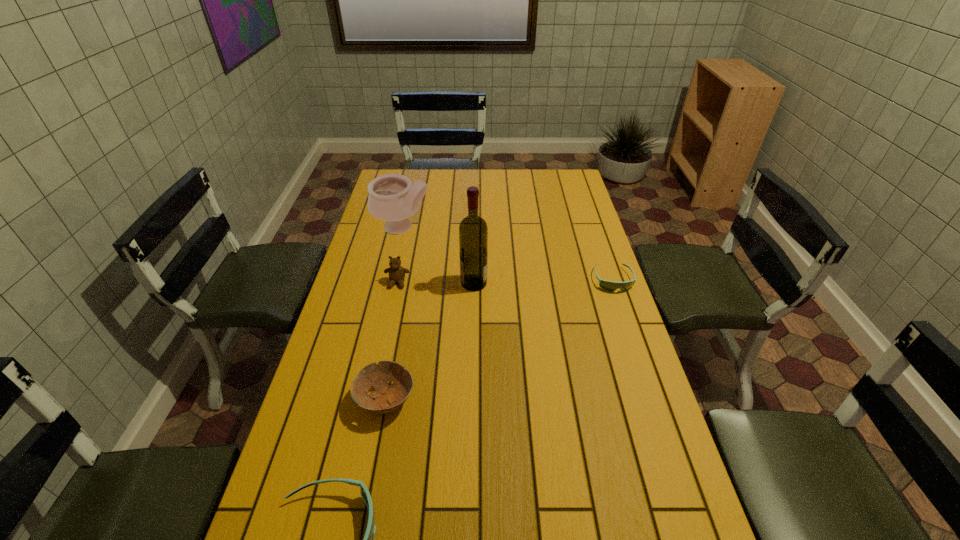
The image size is (960, 540). What are the coordinates of `vacant space that satisfies the following two spatial constraints: 1. on the front-facing side of the rightmost object; 2. on the front and back of the second object from right to left` in the screenshot? It's located at (613, 283).

Locate an element on the screen. The height and width of the screenshot is (540, 960). vacant space that satisfies the following two spatial constraints: 1. on the front-facing side of the shorter goggles; 2. on the front and back of the tallest object is located at coordinates 613,283.